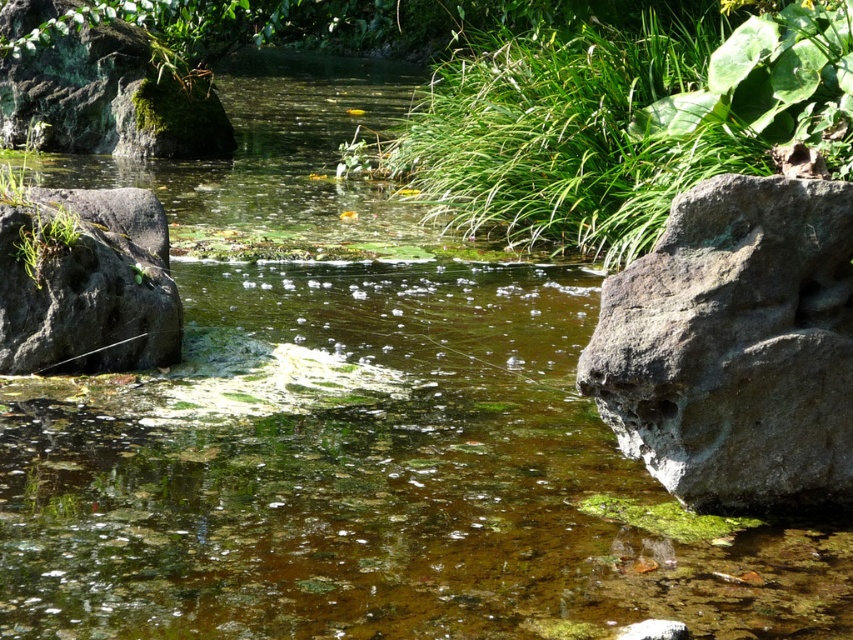
You are a gardener trying to plant a new shrub in this area. You need to choose between placing it next to the green leafy plant at center or the gray rough rock at right. Which location has more space available for the shrub?

The green leafy plant at center has a larger width than the gray rough rock at right, so there is more space available next to the green leafy plant at center for the shrub.

You are a small frog trying to jump from the green mossy rock at upper left to the green leafy plant at center. Can you reach it in one jump if your maximum jump distance is 15 cm?

The green leafy plant at center is taller than green mossy rock at upper left, but the distance between them isn not specified in the description. Therefore, it is impossible to determine if the frog can reach it in one jump based on the provided information.

You are a frog trying to jump from the green mossy rock at upper left to the green leafy plant at center. Can you reach it in one jump?

The green leafy plant at center is larger in size than the green mossy rock at upper left, but the description does not provide information about the distance between them. Therefore, it is impossible to determine if the frog can reach it in one jump based on the given information.